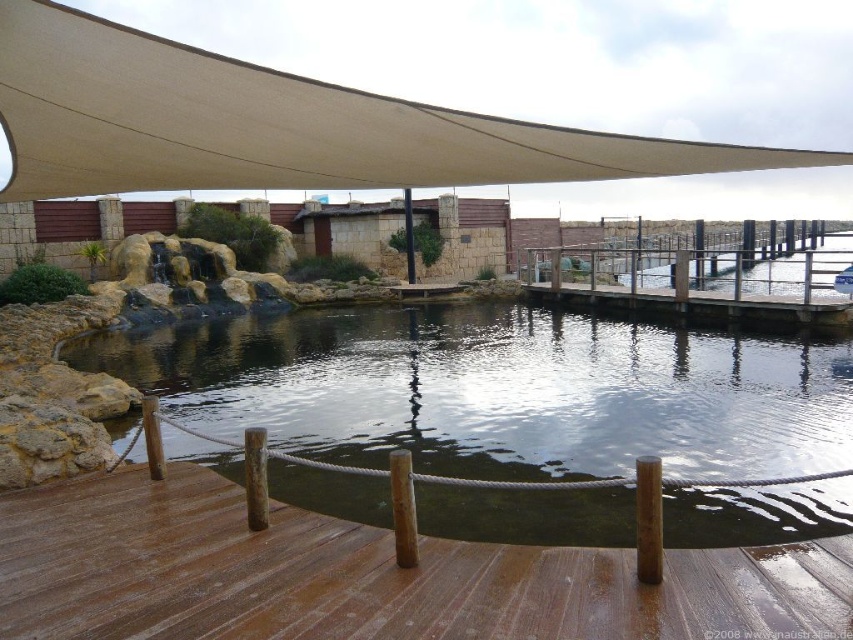
Between brown wooden deck at center and beige fabric canopy at upper center, which one is positioned higher?

beige fabric canopy at upper center is above.

Does point (137, 561) come behind point (178, 182)?

No, (137, 561) is closer to viewer.

Where is `brown wooden deck at center`? brown wooden deck at center is located at coordinates (368, 576).

Can you confirm if clear water at center is taller than brown wooden deck at center?

A: Correct, clear water at center is much taller as brown wooden deck at center.

Who is more distant from viewer, [451,362] or [215,518]?

Point [451,362]

Is point (636, 433) closer to camera compared to point (96, 500)?

No, (636, 433) is behind (96, 500).

You are a GUI agent. You are given a task and a screenshot of the screen. Output one action in this format:
    pyautogui.click(x=<x>, y=<y>)
    Task: Click on the clear water at center
    
    Given the screenshot: What is the action you would take?
    pyautogui.click(x=497, y=388)

Which is below, clear water at center or beige fabric canopy at upper center?

clear water at center is below.

Does point (207, 353) lie in front of point (183, 84)?

No, it is behind (183, 84).

Identify the location of clear water at center. (497, 388).